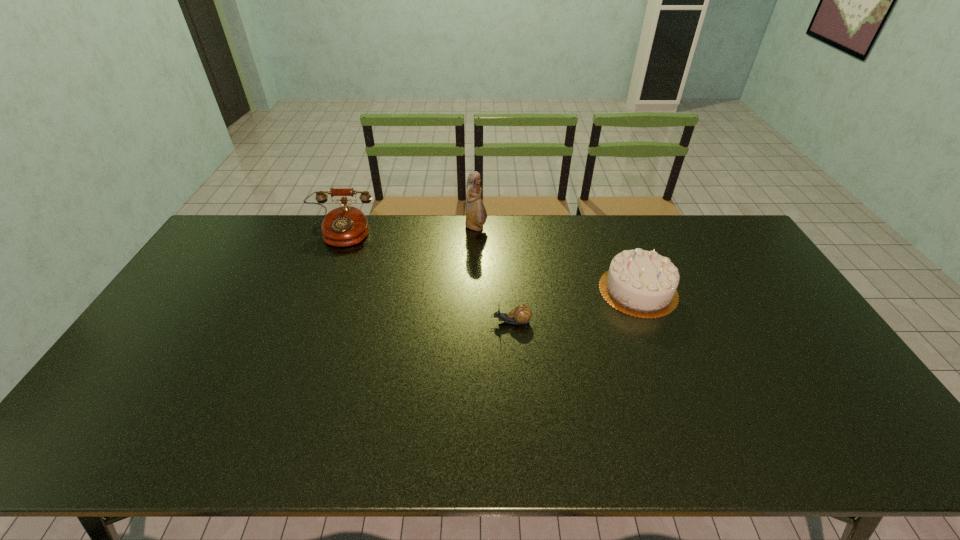
Locate an element on the screen. unoccupied position between the third object from right to left and the shortest object is located at coordinates (493, 275).

The height and width of the screenshot is (540, 960). Identify the location of vacant point located between the birthday cake and the escargot. (574, 306).

Find the location of `free spot between the telephone and the figurine`. free spot between the telephone and the figurine is located at coordinates (408, 231).

Identify the location of blank region between the escargot and the telephone. (425, 278).

The width and height of the screenshot is (960, 540). Find the location of `free space between the shortest object and the leftmost object`. free space between the shortest object and the leftmost object is located at coordinates (425, 278).

At what (x,y) coordinates should I click in order to perform the action: click on blank region between the second object from right to left and the second object from left to right. Please return your answer as a coordinate pair (x, y). Looking at the image, I should click on (493, 275).

Locate an element on the screen. Image resolution: width=960 pixels, height=540 pixels. vacant region between the figurine and the birthday cake is located at coordinates (557, 259).

Locate an element on the screen. free space that is in between the tallest object and the birthday cake is located at coordinates (557, 259).

Locate which object is the closest to the second object from left to right. Please provide its 2D coordinates. Your answer should be formatted as a tuple, i.e. [(x, y)], where the tuple contains the x and y coordinates of a point satisfying the conditions above.

[(344, 226)]

Identify the location of object that ranks as the closest to the third object from right to left. This screenshot has width=960, height=540. (344, 226).